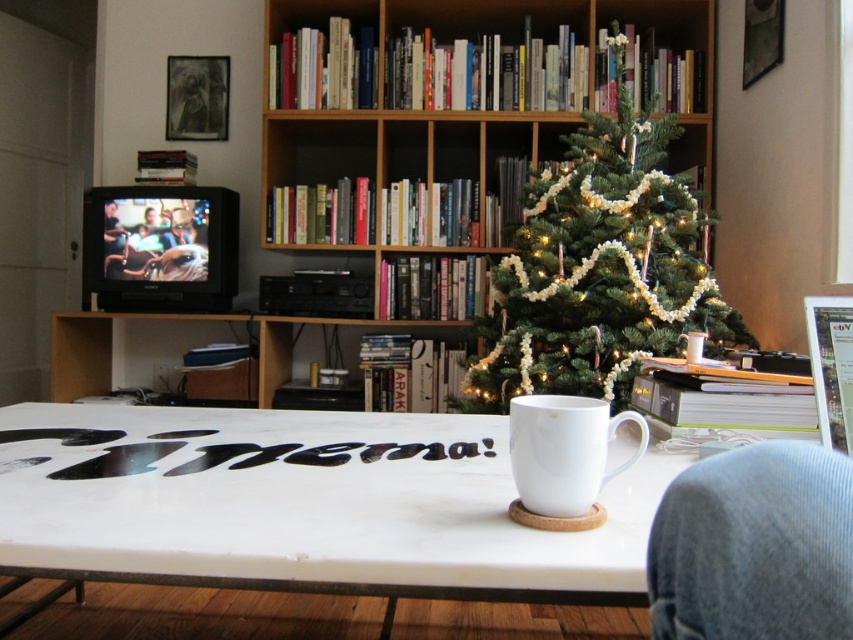
Question: Does white glossy table at center appear on the left side of green textured christmas tree at center?

Choices:
 (A) no
 (B) yes

Answer: (B)

Question: Where is green textured christmas tree at center located in relation to white ceramic mug at center in the image?

Choices:
 (A) below
 (B) above

Answer: (B)

Question: Which object is the closest to the white ceramic mug at center?

Choices:
 (A) green textured christmas tree at center
 (B) white glossy table at center

Answer: (B)

Question: Which point is farther to the camera?

Choices:
 (A) (647, 275)
 (B) (579, 483)
 (C) (624, 472)

Answer: (A)

Question: Does white glossy table at center have a greater width compared to white ceramic mug at center?

Choices:
 (A) yes
 (B) no

Answer: (A)

Question: Which point appears closest to the camera in this image?

Choices:
 (A) (672, 224)
 (B) (181, 493)

Answer: (B)